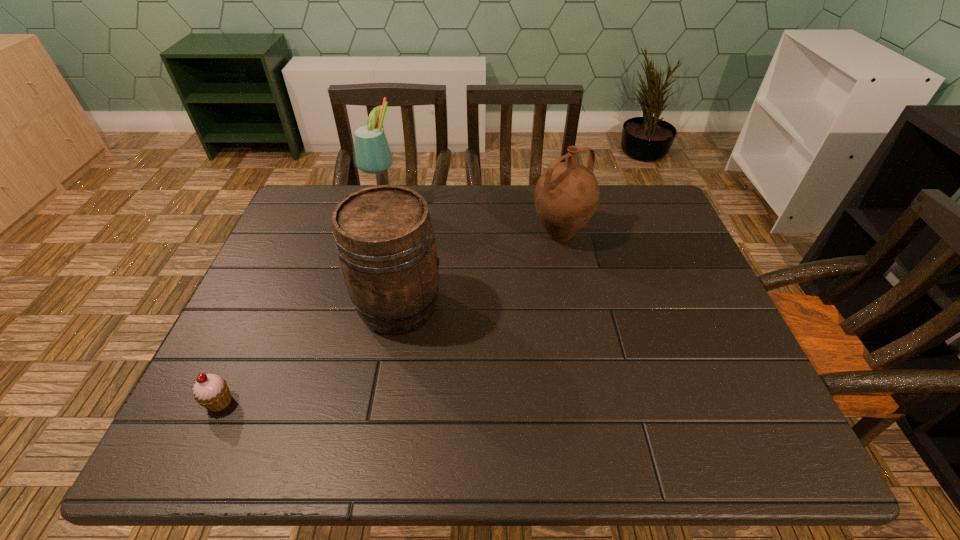
The image size is (960, 540). In order to click on vacant space at the near right corner of the desktop in this screenshot , I will do `click(755, 425)`.

I want to click on free point between the alcohol and the shortest object, so click(x=302, y=305).

Where is `free space between the shortest object and the tallest object`? free space between the shortest object and the tallest object is located at coordinates (302, 305).

Where is `vacant space that is in between the second nearest object and the cupcake`? This screenshot has width=960, height=540. vacant space that is in between the second nearest object and the cupcake is located at coordinates (309, 354).

You are a GUI agent. You are given a task and a screenshot of the screen. Output one action in this format:
    pyautogui.click(x=<x>, y=<y>)
    Task: Click on the free space between the nearest object and the cider
    
    Given the screenshot: What is the action you would take?
    pyautogui.click(x=309, y=354)

Locate an element on the screen. The width and height of the screenshot is (960, 540). vacant region between the nearest object and the third farthest object is located at coordinates (309, 354).

At what (x,y) coordinates should I click in order to perform the action: click on empty space that is in between the nearest object and the third farthest object. Please return your answer as a coordinate pair (x, y). The width and height of the screenshot is (960, 540). Looking at the image, I should click on (309, 354).

Select which object appears as the third closest to the cider. Please provide its 2D coordinates. Your answer should be formatted as a tuple, i.e. [(x, y)], where the tuple contains the x and y coordinates of a point satisfying the conditions above.

[(566, 195)]

The width and height of the screenshot is (960, 540). What are the coordinates of `the closest object to the shortest object` in the screenshot? It's located at (384, 238).

In order to click on free location that satisfies the following two spatial constraints: 1. on the back side of the tallest object; 2. on the left side of the cupcake in this screenshot , I will do `click(308, 209)`.